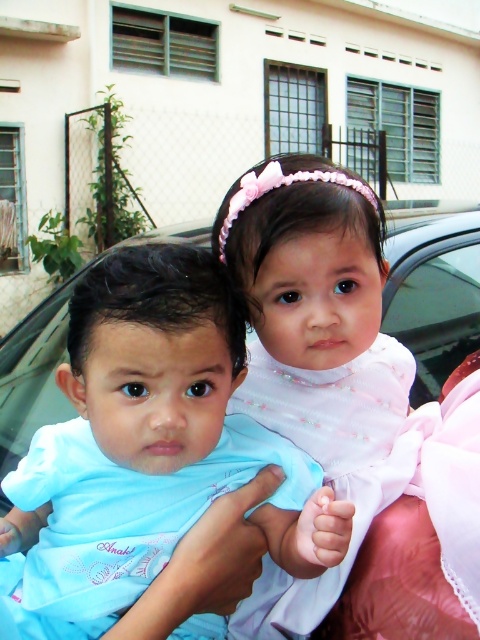
You are standing in front of the beige building with the children and want to place a small flag at the point closer to you. Which point should you choose between point (26, 611) and point (436, 340)?

You should choose point (26, 611) because it is closer to the viewer than point (436, 340).

In the scene shown: You are a photographer trying to position a light blue fabric baby at center for a photo shoot. The camera is set at a fixed position. If the baby is currently at point 0.703, 0.315, which is slightly to the right and above the center of the frame, how should you adjust the baby to center it perfectly?

To center the light blue fabric baby at center, move it slightly to the left and down since it is currently positioned at point [151,449], which is to the right and above the frame center.

Looking at this image, you are a photographer taking a picture of the scene described. You need to focus on the white satin dress at center. According to the coordinates provided, where exactly should you position your camera to ensure the dress is centered in the frame?

The white satin dress at center is located at coordinates point (313, 348), so you should position your camera to center the frame at those coordinates to capture the dress precisely.